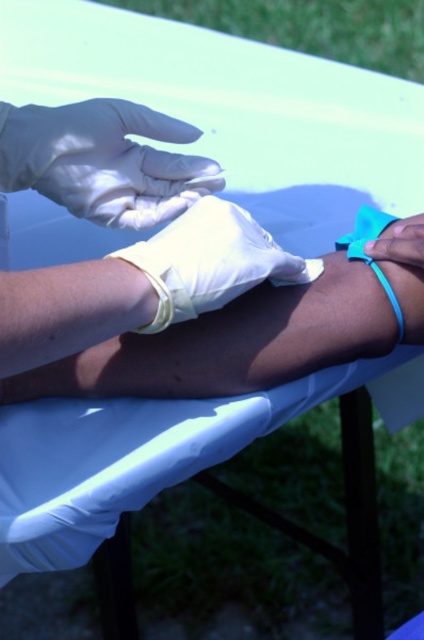
Based on the photo, is white matte glove at center wider than white latex glove at upper center?

Indeed, white matte glove at center has a greater width compared to white latex glove at upper center.

Does white matte glove at center lie behind white latex glove at upper center?

No, it is in front of white latex glove at upper center.

Image resolution: width=424 pixels, height=640 pixels. I want to click on white matte glove at center, so [x=141, y=285].

Consider the image. Between white latex glove at center and blue rubber band at lower right, which one appears on the left side from the viewer's perspective?

white latex glove at center is more to the left.

Can you confirm if white latex glove at center is positioned below blue rubber band at lower right?

No, white latex glove at center is not below blue rubber band at lower right.

What are the coordinates of `white latex glove at center` in the screenshot? It's located at (211, 260).

The image size is (424, 640). I want to click on white latex glove at center, so click(211, 260).

From the picture: Who is more distant from viewer, (240,220) or (187,224)?

Positioned behind is point (240,220).

Which is more to the right, white matte glove at center or white latex glove at center?

Positioned to the right is white latex glove at center.

Is point (206, 221) positioned after point (248, 236)?

No.

You are a GUI agent. You are given a task and a screenshot of the screen. Output one action in this format:
    pyautogui.click(x=<x>, y=<y>)
    Task: Click on the white matte glove at center
    This screenshot has height=640, width=424.
    Given the screenshot: What is the action you would take?
    pyautogui.click(x=141, y=285)